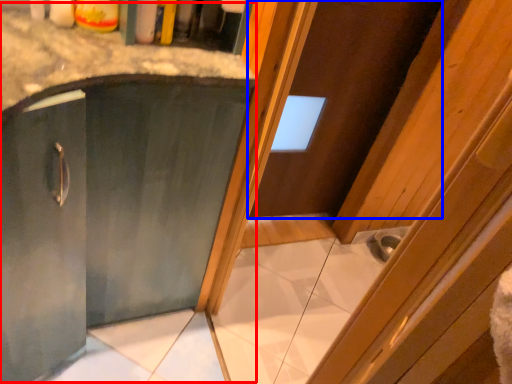
Question: Which object appears closest to the camera in this image, cabinetry (highlighted by a red box) or door (highlighted by a blue box)?

Choices:
 (A) cabinetry
 (B) door

Answer: (A)